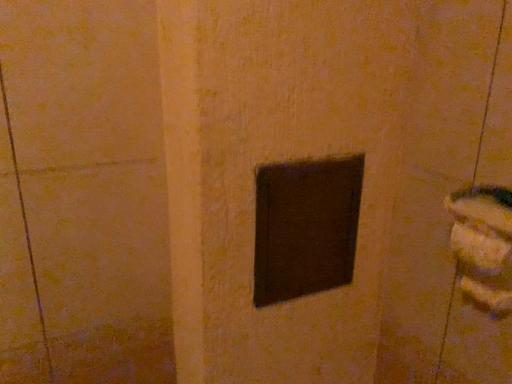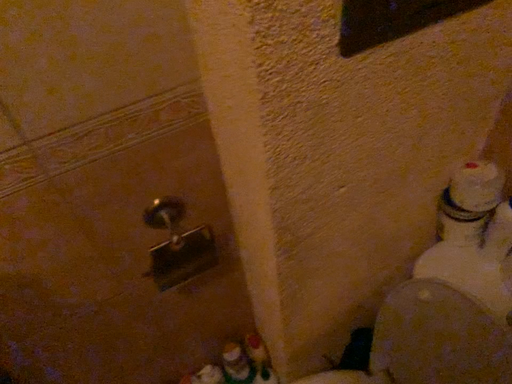
Question: Which way did the camera rotate in the video?

Choices:
 (A) rotated upward
 (B) rotated downward

Answer: (B)